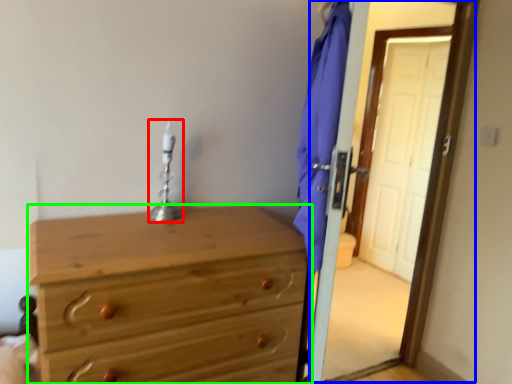
Question: Estimate the real-world distances between objects in this image. Which object is closer to table lamp (highlighted by a red box), screen door (highlighted by a blue box) or chest of drawers (highlighted by a green box)?

Choices:
 (A) screen door
 (B) chest of drawers

Answer: (B)